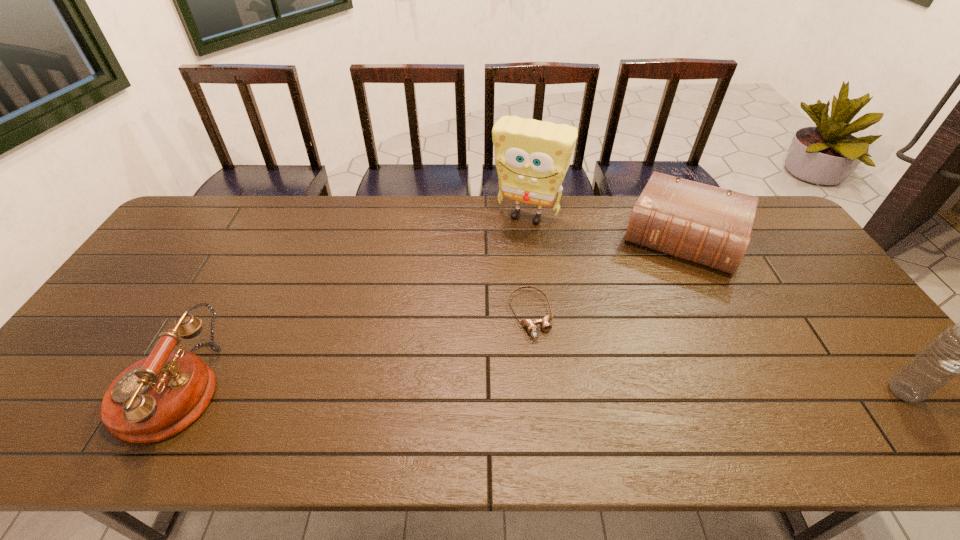
Locate an element on the screen. the third shortest object is located at coordinates (157, 397).

The width and height of the screenshot is (960, 540). Identify the location of the leftmost object. click(157, 397).

Find the location of a particular element. The width and height of the screenshot is (960, 540). water bottle is located at coordinates (959, 350).

Locate an element on the screen. the fourth shortest object is located at coordinates (959, 350).

Identify the location of goggles. This screenshot has height=540, width=960. (530, 325).

What are the coordinates of `Bible` in the screenshot? It's located at (710, 226).

Identify the location of the second object from right to left. The height and width of the screenshot is (540, 960). (710, 226).

Locate an element on the screen. sponge is located at coordinates (532, 157).

The image size is (960, 540). I want to click on free space located 0.050m on the dial of the telephone, so click(x=105, y=390).

Where is `vacant space located on the dial of the telephone`? vacant space located on the dial of the telephone is located at coordinates (54, 390).